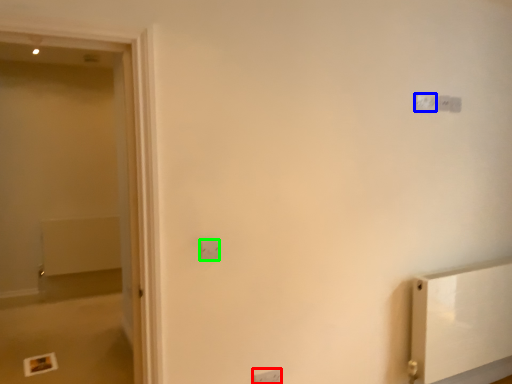
Question: Which object is the farthest from light switch (highlighted by a red box)? Choose among these: light switch (highlighted by a blue box) or light switch (highlighted by a green box).

Choices:
 (A) light switch
 (B) light switch

Answer: (A)